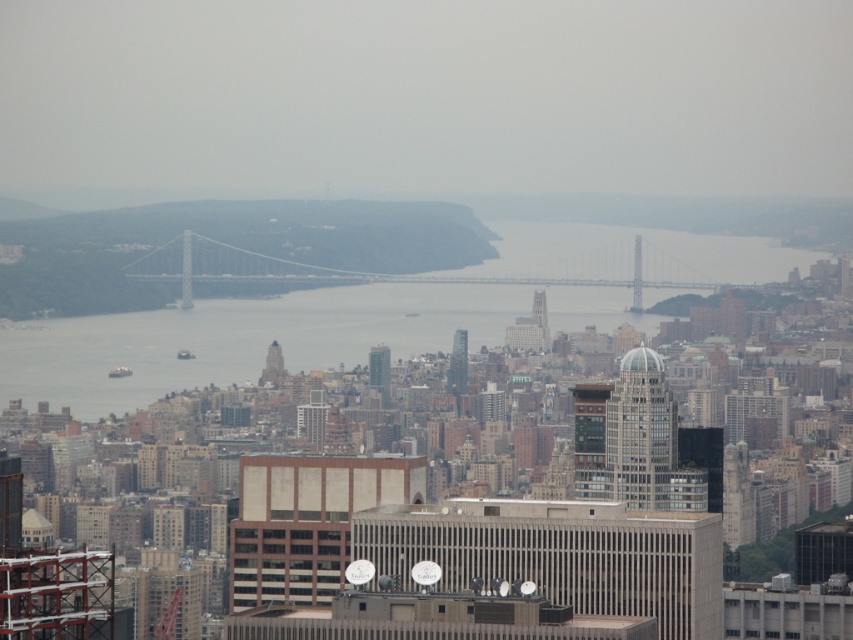
Which is behind, point (636, 384) or point (448, 380)?

Positioned behind is point (636, 384).

From the picture: Can you confirm if clear glass skyscraper at center is shorter than glassy silver skyscraper at center?

Incorrect, clear glass skyscraper at center's height does not fall short of glassy silver skyscraper at center's.

Locate an element on the screen. Image resolution: width=853 pixels, height=640 pixels. clear glass skyscraper at center is located at coordinates (641, 433).

Is glassy skyscraper at center below glassy silver skyscraper at center?

Correct, glassy skyscraper at center is located below glassy silver skyscraper at center.

Is point (386, 358) positioned in front of point (463, 376)?

Yes, point (386, 358) is in front of point (463, 376).

Where is `glassy skyscraper at center`? glassy skyscraper at center is located at coordinates (379, 371).

Which is above, gray water at center or glassy skyscraper at center?

gray water at center

Measure the distance between gray water at center and camera.

gray water at center and camera are 646.78 meters apart.

Between point (3, 380) and point (386, 358), which one is positioned in front?

Point (386, 358)

The height and width of the screenshot is (640, 853). I want to click on gray water at center, so click(x=273, y=337).